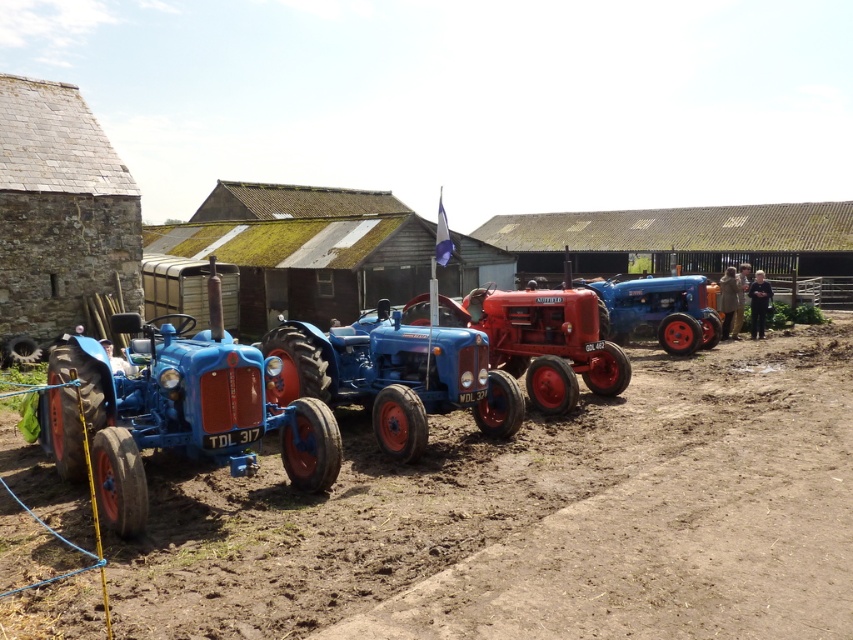
You are a farmer who needs to move a 10 feet long fence panel between the brown soil at lower center and the red matte tractor at center. Is there enough space to place the fence panel between them?

The distance between the brown soil at lower center and the red matte tractor at center is 11.33 feet, which is longer than the 10 feet fence panel. Therefore, there is enough space to place the fence panel between them.

You are a farmer standing in the middle of the farmyard. You need to move the red matte tractor at center to the right side of the brown soil at lower center. Is this possible without moving the brown soil?

The brown soil at lower center is positioned on the left side of the red matte tractor at center. To move the red matte tractor at center to the right side of the brown soil at lower center, you would need to shift the tractor to the right, which is feasible since the soil is stationary and the tractor can be moved independently. Yes, this is possible without disturbing the brown soil.